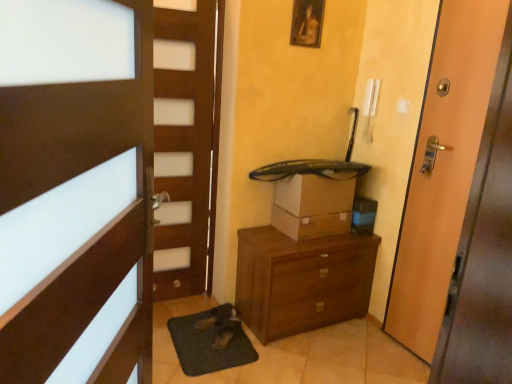
Describe the element at coordinates (211, 341) in the screenshot. The height and width of the screenshot is (384, 512). I see `green rubber bath mat at lower center` at that location.

Image resolution: width=512 pixels, height=384 pixels. I want to click on brown wooden door at left, which is the first door in front-to-back order, so click(x=75, y=190).

You are a GUI agent. You are given a task and a screenshot of the screen. Output one action in this format:
    pyautogui.click(x=<x>, y=<y>)
    Task: Click on the wooden door at right, which is counted as the first door, starting from the back
    The height and width of the screenshot is (384, 512).
    Given the screenshot: What is the action you would take?
    pyautogui.click(x=443, y=167)

Image resolution: width=512 pixels, height=384 pixels. Describe the element at coordinates (301, 281) in the screenshot. I see `brown wooden chest of drawers at center` at that location.

Identify the location of brown wooden chest of drawers at center. (301, 281).

Based on the photo, what is the approximate width of brown cardboard box at center?

The width of brown cardboard box at center is 11.60 inches.

Find the location of a particular element. The image size is (512, 384). green rubber bath mat at lower center is located at coordinates (211, 341).

From the image's perspective, is wooden door at right, which is counted as the 2th door, starting from the left, above wooden picture frame at upper center?

No, from the image's perspective, wooden door at right, which is counted as the 2th door, starting from the left, is not above wooden picture frame at upper center.

Is wooden door at right, the 1th door when ordered from right to left, positioned with its back to wooden picture frame at upper center?

No.

There is a wooden picture frame at upper center. Identify the location of the 1st door below it (from the image's perspective). This screenshot has height=384, width=512. (443, 167).

Who is shorter, brown wooden chest of drawers at center or brown cardboard box at center?

With less height is brown cardboard box at center.

Is brown cardboard box at center at the back of brown wooden chest of drawers at center?

brown wooden chest of drawers at center is not turned away from brown cardboard box at center.

How far apart are brown wooden chest of drawers at center and brown cardboard box at center?

They are 9.98 inches apart.

Can we say brown wooden chest of drawers at center lies outside brown cardboard box at center?

brown wooden chest of drawers at center lies outside brown cardboard box at center's area.

Is green rubber bath mat at lower center inside or outside of brown wooden door at left, which is the first door in front-to-back order?

green rubber bath mat at lower center is spatially situated outside brown wooden door at left, which is the first door in front-to-back order.

From the image's perspective, would you say green rubber bath mat at lower center is positioned over brown wooden door at left, which is the 2th door in right-to-left order?

No, from the image's perspective, green rubber bath mat at lower center is not above brown wooden door at left, which is the 2th door in right-to-left order.

Considering the sizes of green rubber bath mat at lower center and brown wooden door at left, the 1th door in the left-to-right sequence, in the image, is green rubber bath mat at lower center wider or thinner than brown wooden door at left, the 1th door in the left-to-right sequence,?

Clearly, green rubber bath mat at lower center has more width compared to brown wooden door at left, the 1th door in the left-to-right sequence.

Considering the relative sizes of green rubber bath mat at lower center and brown wooden door at left, the 1th door in the left-to-right sequence, in the image provided, is green rubber bath mat at lower center taller than brown wooden door at left, the 1th door in the left-to-right sequence,?

In fact, green rubber bath mat at lower center may be shorter than brown wooden door at left, the 1th door in the left-to-right sequence.

Measure the distance from brown wooden door at left, which is the 2th door in right-to-left order, to brown wooden chest of drawers at center.

They are 1.44 meters apart.

From a real-world perspective, between brown wooden door at left, acting as the second door starting from the back, and brown wooden chest of drawers at center, who is vertically lower?

In real-world perspective, brown wooden chest of drawers at center is lower.

At what (x,y) coordinates should I click in order to perform the action: click on the chest of drawers that is behind the brown wooden door at left, which is the 2th door in right-to-left order. Please return your answer as a coordinate pair (x, y). Looking at the image, I should click on click(301, 281).

Is brown wooden chest of drawers at center completely or partially inside brown wooden door at left, which is the 2th door in right-to-left order?

Definitely not — brown wooden chest of drawers at center is not inside brown wooden door at left, which is the 2th door in right-to-left order.

From a real-world perspective, who is located higher, wooden picture frame at upper center or brown cardboard box at center?

In real-world perspective, wooden picture frame at upper center is above.

Is brown cardboard box at center a part of wooden picture frame at upper center?

No, wooden picture frame at upper center does not contain brown cardboard box at center.

Is wooden picture frame at upper center at the left side of brown cardboard box at center?

Yes.

From the image's perspective, is brown wooden door at left, which is the first door in front-to-back order, located above or below green rubber bath mat at lower center?

From the image's perspective, brown wooden door at left, which is the first door in front-to-back order, appears above green rubber bath mat at lower center.

Are brown wooden door at left, which is the 2th door in right-to-left order, and green rubber bath mat at lower center far apart?

brown wooden door at left, which is the 2th door in right-to-left order, is positioned a significant distance from green rubber bath mat at lower center.

Looking at this image, considering the sizes of objects brown wooden door at left, the 1th door in the left-to-right sequence, and green rubber bath mat at lower center in the image provided, who is taller, brown wooden door at left, the 1th door in the left-to-right sequence, or green rubber bath mat at lower center?

brown wooden door at left, the 1th door in the left-to-right sequence, is taller.

Could you tell me if brown wooden door at left, which is the 2th door in right-to-left order, is turned towards green rubber bath mat at lower center?

No, brown wooden door at left, which is the 2th door in right-to-left order, is not facing towards green rubber bath mat at lower center.

In the scene shown: Is wooden picture frame at upper center taller than brown wooden door at left, acting as the second door starting from the back?

No.

Is wooden picture frame at upper center positioned before brown wooden door at left, which is the 2th door in right-to-left order?

No, it is behind brown wooden door at left, which is the 2th door in right-to-left order.

Is wooden picture frame at upper center next to brown wooden door at left, the 1th door in the left-to-right sequence, and touching it?

No, wooden picture frame at upper center is not making contact with brown wooden door at left, the 1th door in the left-to-right sequence.

Between wooden picture frame at upper center and brown wooden door at left, the 1th door in the left-to-right sequence, which one has smaller width?

wooden picture frame at upper center.

You are a GUI agent. You are given a task and a screenshot of the screen. Output one action in this format:
    pyautogui.click(x=<x>, y=<y>)
    Task: Click on the door located on the right of wooden picture frame at upper center
    This screenshot has width=512, height=384.
    Given the screenshot: What is the action you would take?
    pyautogui.click(x=443, y=167)

At what (x,y) coordinates should I click in order to perform the action: click on the chest of drawers below the brown cardboard box at center (from the image's perspective). Please return your answer as a coordinate pair (x, y). Looking at the image, I should click on (301, 281).

Looking at the image, which one is located closer to brown wooden chest of drawers at center, brown wooden door at left, which is the first door in front-to-back order, or brown cardboard box at center?

Based on the image, brown cardboard box at center appears to be nearer to brown wooden chest of drawers at center.

Estimate the real-world distances between objects in this image. Which object is closer to green rubber bath mat at lower center, wooden picture frame at upper center or brown wooden chest of drawers at center?

brown wooden chest of drawers at center lies closer to green rubber bath mat at lower center than the other object.

Looking at this image, based on their spatial positions, is brown cardboard box at center or brown wooden chest of drawers at center closer to brown wooden door at left, the 1th door in the left-to-right sequence?

Based on the image, brown wooden chest of drawers at center appears to be nearer to brown wooden door at left, the 1th door in the left-to-right sequence.

Which object lies nearer to the anchor point brown wooden door at left, which is the first door in front-to-back order, brown wooden chest of drawers at center or wooden picture frame at upper center?

brown wooden chest of drawers at center is positioned closer to the anchor brown wooden door at left, which is the first door in front-to-back order.

From the image, which object appears to be nearer to brown cardboard box at center, wooden picture frame at upper center or brown wooden door at left, which is the first door in front-to-back order?

Based on the image, wooden picture frame at upper center appears to be nearer to brown cardboard box at center.

Considering their positions, is wooden picture frame at upper center positioned closer to brown wooden door at left, acting as the second door starting from the back, than wooden door at right, which is counted as the 2th door, starting from the left?

Based on the image, wooden door at right, which is counted as the 2th door, starting from the left, appears to be nearer to brown wooden door at left, acting as the second door starting from the back.

Based on their spatial positions, is green rubber bath mat at lower center or wooden door at right, the 1th door when ordered from right to left, further from brown wooden door at left, which is the 2th door in right-to-left order?

The object further to brown wooden door at left, which is the 2th door in right-to-left order, is wooden door at right, the 1th door when ordered from right to left.

In the scene shown: Considering their positions, is green rubber bath mat at lower center positioned closer to brown wooden door at left, which is the first door in front-to-back order, than brown wooden chest of drawers at center?

Among the two, green rubber bath mat at lower center is located nearer to brown wooden door at left, which is the first door in front-to-back order.

This screenshot has height=384, width=512. What are the coordinates of `door positioned between brown wooden door at left, which is the first door in front-to-back order, and brown wooden chest of drawers at center from near to far` in the screenshot? It's located at (443, 167).

This screenshot has height=384, width=512. Identify the location of chest of drawers between green rubber bath mat at lower center and wooden door at right, which is counted as the first door, starting from the back, from left to right. (301, 281).

The height and width of the screenshot is (384, 512). I want to click on door between brown wooden door at left, acting as the second door starting from the back, and green rubber bath mat at lower center in the front-back direction, so click(443, 167).

Locate an element on the screen. The image size is (512, 384). door positioned between brown wooden door at left, acting as the second door starting from the back, and brown cardboard box at center from near to far is located at coordinates (443, 167).